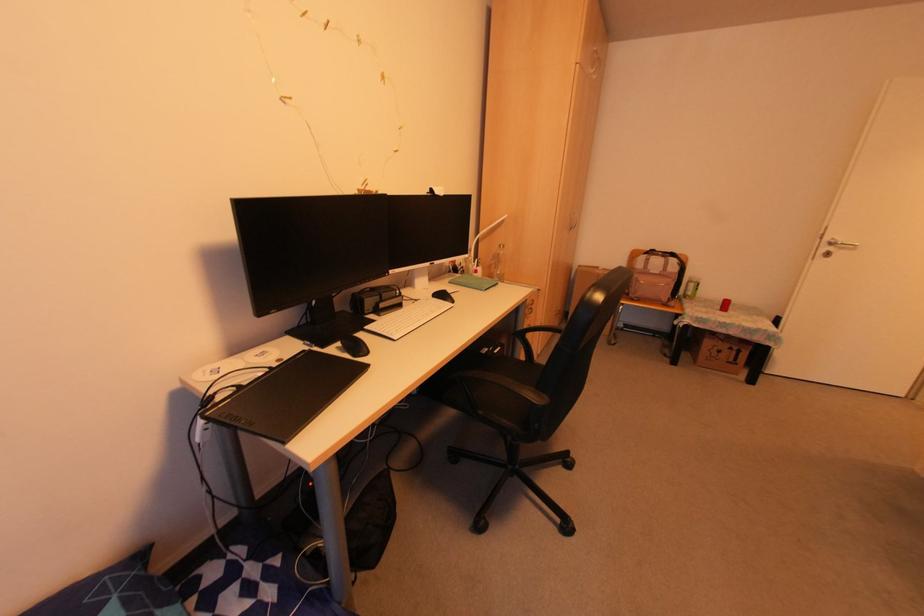
The width and height of the screenshot is (924, 616). Identify the location of chair armrest. (537, 330).